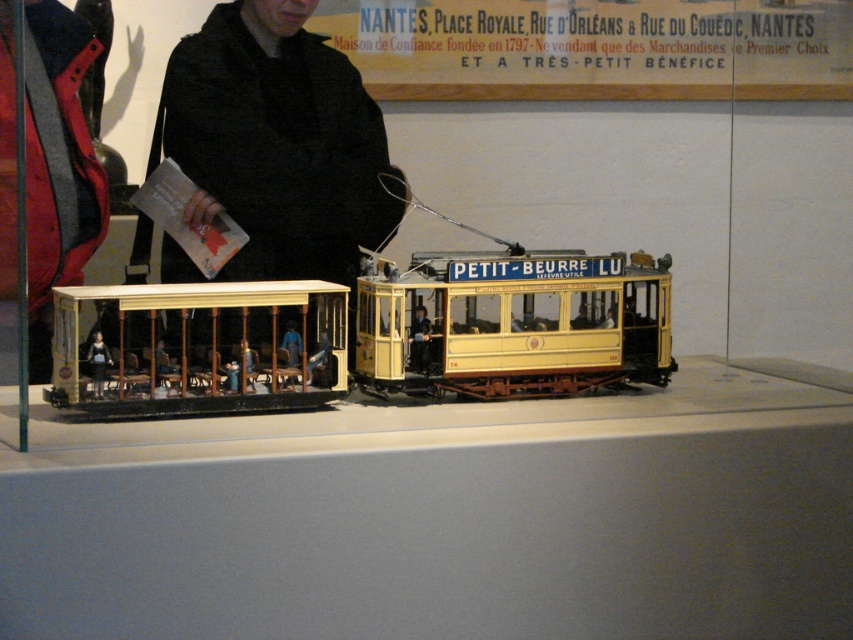
Is yellow matte/light wood train car at center to the left of light beige wood train car at left from the viewer's perspective?

In fact, yellow matte/light wood train car at center is to the right of light beige wood train car at left.

Which is in front, point (498, 300) or point (132, 372)?

Positioned in front is point (132, 372).

What do you see at coordinates (514, 323) in the screenshot? This screenshot has width=853, height=640. I see `yellow matte/light wood train car at center` at bounding box center [514, 323].

I want to click on yellow matte/light wood train car at center, so click(514, 323).

Does point (260, 134) come in front of point (828, 26)?

Yes.

Is black fabric at center closer to the viewer compared to yellow paper at upper center?

Yes, it is.

Where is `black fabric at center`? This screenshot has width=853, height=640. black fabric at center is located at coordinates (277, 141).

Can you confirm if black fabric at center is taller than yellow matte/light wood train car at center?

Correct, black fabric at center is much taller as yellow matte/light wood train car at center.

Does black fabric at center appear on the right side of yellow matte/light wood train car at center?

Incorrect, black fabric at center is not on the right side of yellow matte/light wood train car at center.

Does point (351, 145) come closer to viewer compared to point (396, 288)?

No, (351, 145) is behind (396, 288).

Find the location of a particular element. black fabric at center is located at coordinates (277, 141).